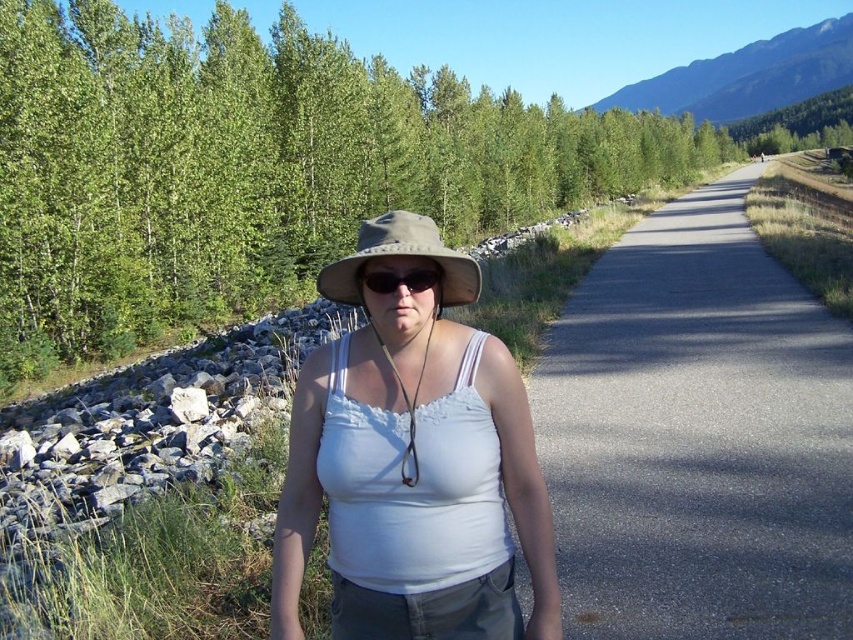
You are a photographer trying to capture a landscape photo of the mountain range behind the person. Your camera is 6 feet away from the tan fabric hat at center. Can you position yourself so that the camera is closer to the hat than the mountain range?

The tan fabric hat at center and camera are 6.00 feet apart. Since the mountain range is in the background, it is much farther away than 6 feet from the hat. Therefore, you can position yourself so that the camera is closer to the hat than the mountain range.

You are a hiker planning to walk along the asphalt road at center. Based on the image, can you determine if the point marked by the coordinates point (698, 436) is located on the asphalt road at center?

The asphalt road at center is represented by point (698, 436), so yes, the point marked by the coordinates point (698, 436) is located on the asphalt road at center.

You are a photographer trying to capture a landscape photo. You have two points marked on your viewfinder at coordinates point (x=611, y=436) and point (x=416, y=240). Which point is closer to the camera?

Point (x=416, y=240) is closer to the camera because it is less further than point (x=611, y=436).